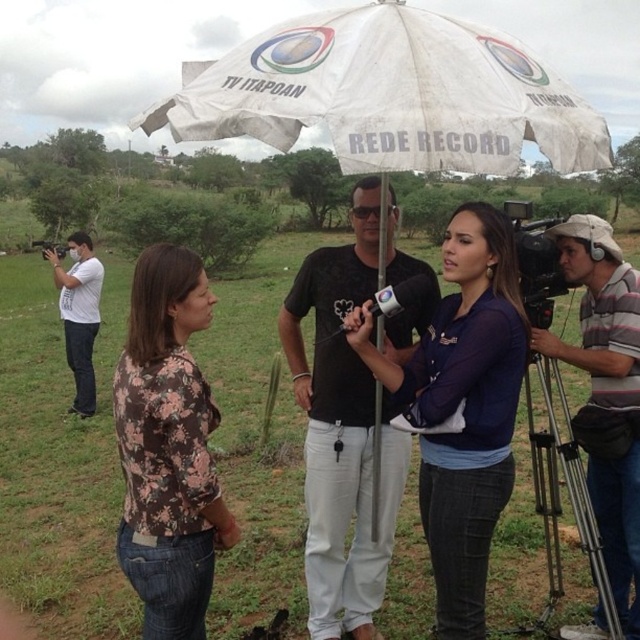
Between blue denim jeans at center and white matte camera at left, which one has more height?

With more height is white matte camera at left.

Find the location of a particular element. The image size is (640, 640). blue denim jeans at center is located at coordinates (464, 406).

Between blue denim jeans at center and black plastic video camera at right, which one is positioned higher?

black plastic video camera at right

Can you confirm if blue denim jeans at center is shorter than black plastic video camera at right?

No.

Measure the distance between blue denim jeans at center and camera.

The distance of blue denim jeans at center from camera is 2.38 meters.

The width and height of the screenshot is (640, 640). I want to click on blue denim jeans at center, so click(464, 406).

Does black matte t-shirt at center have a lesser width compared to floral print shirt at center?

In fact, black matte t-shirt at center might be wider than floral print shirt at center.

Between black matte t-shirt at center and floral print shirt at center, which one is positioned lower?

floral print shirt at center

The width and height of the screenshot is (640, 640). In order to click on black matte t-shirt at center in this screenshot , I will do pos(342,432).